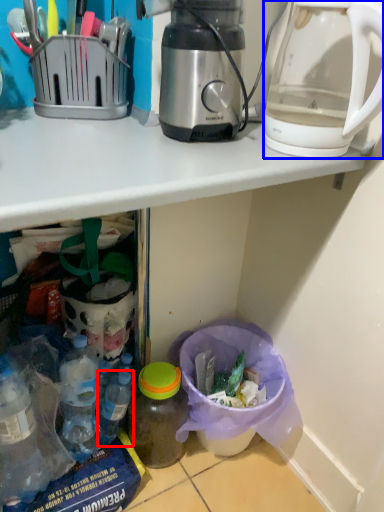
Question: Which of the following is the closest to the observer, bottle (highlighted by a red box) or kettle (highlighted by a blue box)?

Choices:
 (A) bottle
 (B) kettle

Answer: (B)